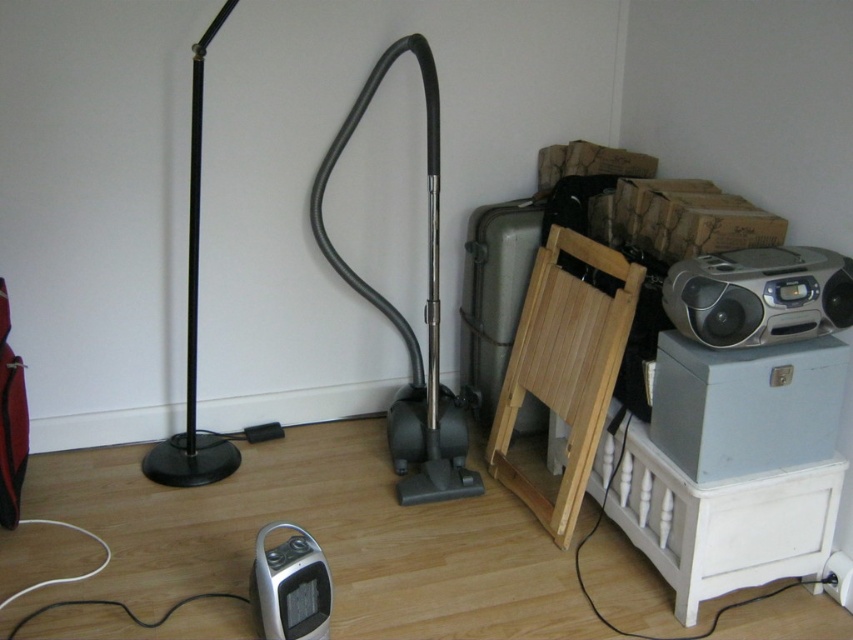
Question: Observing the image, what is the correct spatial positioning of silver metallic boombox at upper right in reference to black matte floor lamp at left?

Choices:
 (A) right
 (B) left

Answer: (A)

Question: Does silver metallic boombox at upper right appear on the left side of black matte floor lamp at left?

Choices:
 (A) no
 (B) yes

Answer: (A)

Question: Can you confirm if silver metallic boombox at upper right is wider than black matte floor lamp at left?

Choices:
 (A) no
 (B) yes

Answer: (B)

Question: Which point appears farthest from the camera in this image?

Choices:
 (A) (218, 458)
 (B) (840, 288)

Answer: (A)

Question: Which point appears farthest from the camera in this image?

Choices:
 (A) (201, 99)
 (B) (737, 344)

Answer: (A)